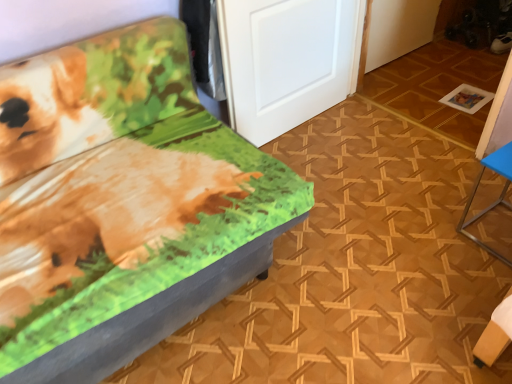
Image resolution: width=512 pixels, height=384 pixels. In order to click on vacant area that lies between blue metallic table at right, which is the 2th furniture from left to right, and printed fabric bench at left, the first furniture from the left in this screenshot , I will do `click(365, 259)`.